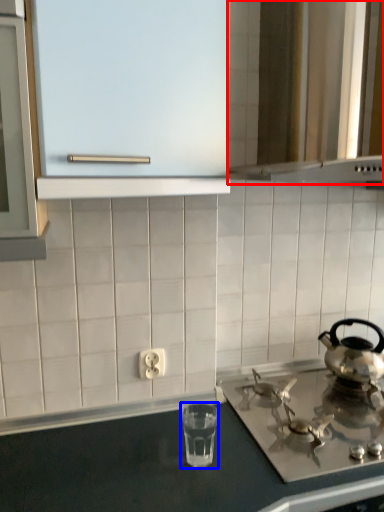
Question: Which object appears closest to the camera in this image, vent (highlighted by a red box) or appliance (highlighted by a blue box)?

Choices:
 (A) vent
 (B) appliance

Answer: (A)